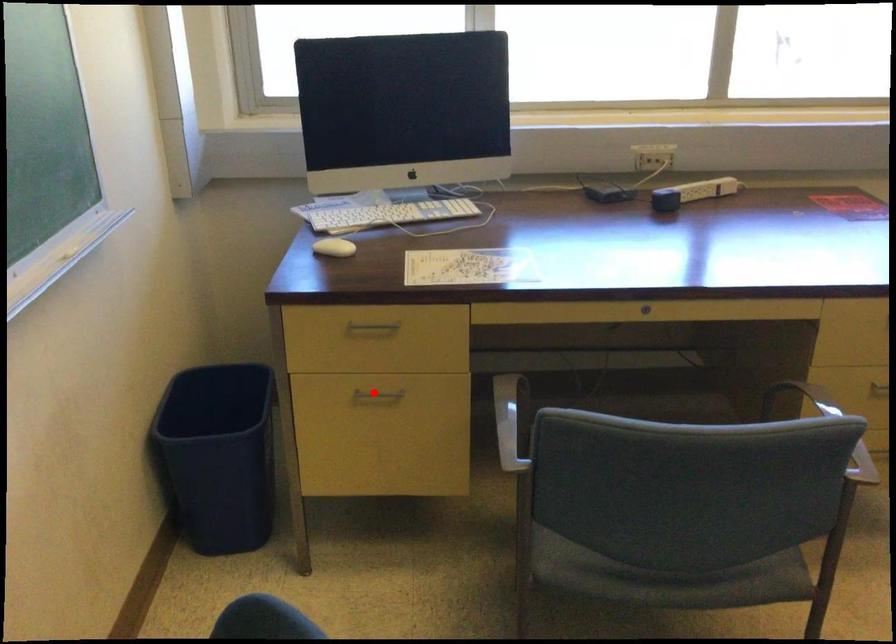
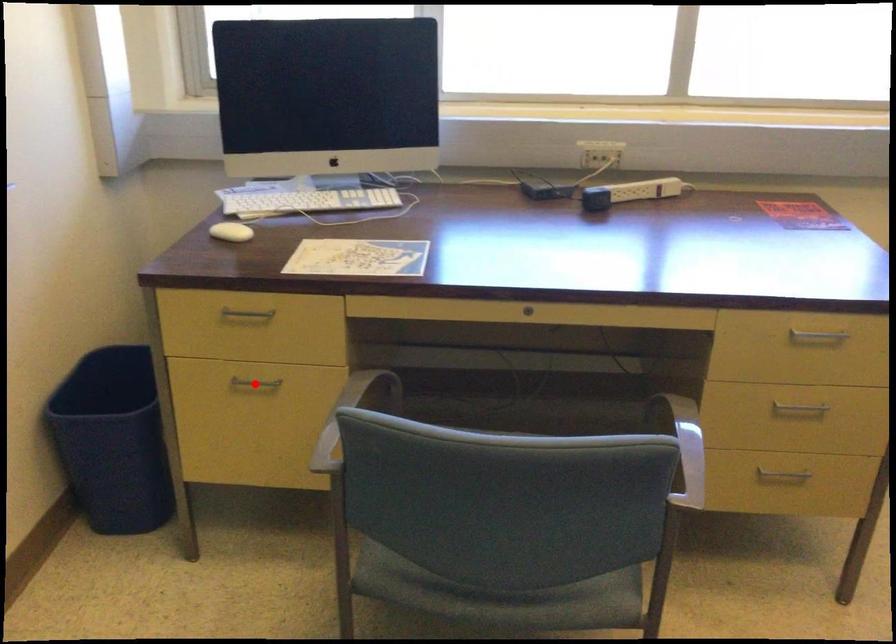
From the picture: I am providing you with two images of the same scene from different viewpoints. A red point is marked on the first image and another point is marked on the second image. Is the red point in image1 aligned with the point shown in image2?

Yes